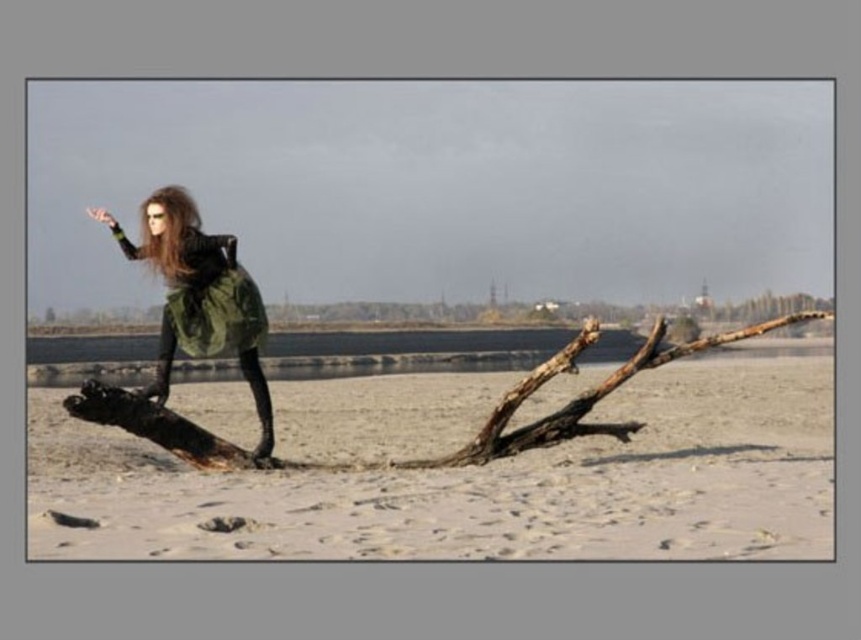
You are a photographer planning to capture a wide shot of the scene. You need to ensure that both the white sandy beach at center and the green matte dress at left are fully visible in the frame. Given that your camera has a minimum focus distance of 10 meters, will you be able to capture both objects in the same frame?

The white sandy beach at center and green matte dress at left are 11.75 meters apart from each other. Since the minimum focus distance is 10 meters, the photographer can capture both objects in the same frame as the distance between them exceeds the minimum requirement.

You are a photographer trying to capture the green matte dress at left and the shiny brown hair at upper left in your shot. Which object should you focus on first to ensure both are in sharp focus?

The green matte dress at left is closer to the viewer than the shiny brown hair at upper left. To ensure both are in sharp focus, you should focus on the green matte dress at left first, as it is the closer object.